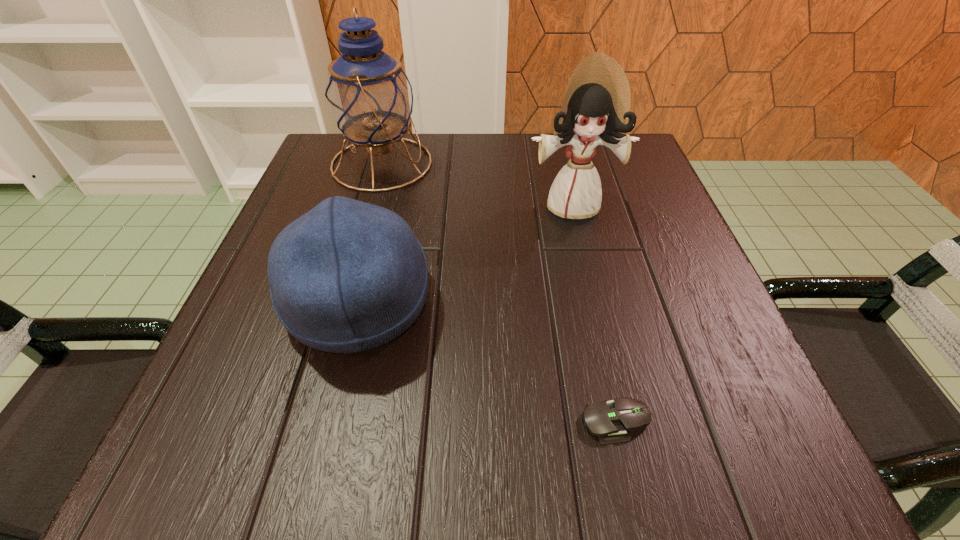
Locate an element on the screen. The height and width of the screenshot is (540, 960). free spot at the far edge of the desktop is located at coordinates (501, 191).

Identify the location of free space at the near edge of the desktop. (606, 446).

At what (x,y) coordinates should I click in order to perform the action: click on vacant space at the right edge of the desktop. Please return your answer as a coordinate pair (x, y). The height and width of the screenshot is (540, 960). Looking at the image, I should click on (650, 206).

I want to click on blank region between the shortest object and the lantern, so click(x=498, y=293).

Locate an element on the screen. free spot between the doll and the lantern is located at coordinates (477, 184).

You are a GUI agent. You are given a task and a screenshot of the screen. Output one action in this format:
    pyautogui.click(x=<x>, y=<y>)
    Task: Click on the free point between the shortest object and the skullcap
    The width and height of the screenshot is (960, 540).
    Given the screenshot: What is the action you would take?
    pyautogui.click(x=487, y=362)

Find the location of `free spot between the shortest object and the second shortest object`. free spot between the shortest object and the second shortest object is located at coordinates (487, 362).

The width and height of the screenshot is (960, 540). What are the coordinates of `free spot between the second nearest object and the computer mouse` in the screenshot? It's located at (487, 362).

This screenshot has width=960, height=540. Find the location of `the third closest object to the lantern`. the third closest object to the lantern is located at coordinates (610, 420).

Where is `object that is the second closest to the doll`? The width and height of the screenshot is (960, 540). object that is the second closest to the doll is located at coordinates (369, 97).